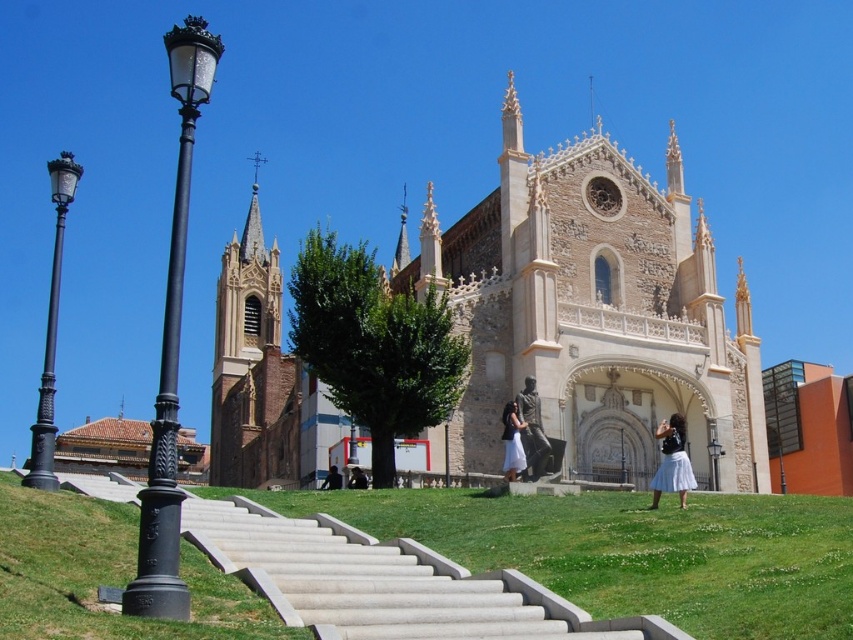
You are standing at the entrance of the church and want to take a photo of the smooth concrete stairs at center. Which direction should you face to capture them in your shot?

The smooth concrete stairs at center are located at point coordinates, so you should face towards the direction where the stairs are positioned. However, without specific coordinate reference, the general direction would be towards the center area in front of the church entrance.

You are standing at the bottom of the steps leading to the church. You see a white cotton skirt at lower right and a white cotton dress at center. Which clothing item is closer to you?

The white cotton skirt at lower right is closer to you because it is in front of the white cotton dress at center.

You are a photographer standing at the bottom of the smooth concrete stairs at center, aiming to capture the church and the white cotton skirt at lower right in the same frame. Which object should you focus on first to ensure both are in view?

You should focus on the smooth concrete stairs at center first because its wider width compared to the white cotton skirt at lower right allows it to be captured more easily in the frame.